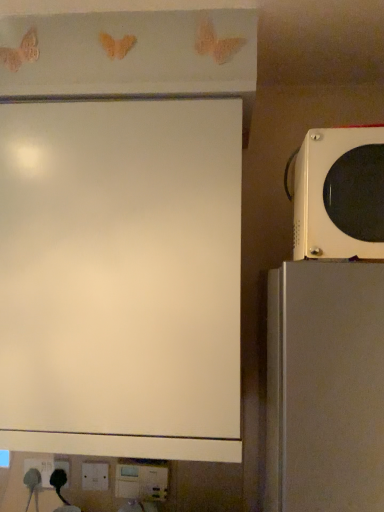
Question: Does white plastic electric outlet at lower left have a greater width compared to white glossy microwave at right?

Choices:
 (A) no
 (B) yes

Answer: (A)

Question: Is white plastic electric outlet at lower left next to white glossy microwave at right?

Choices:
 (A) yes
 (B) no

Answer: (B)

Question: Is white plastic electric outlet at lower left far from white glossy microwave at right?

Choices:
 (A) yes
 (B) no

Answer: (A)

Question: From the image's perspective, would you say white plastic electric outlet at lower left is shown under white glossy microwave at right?

Choices:
 (A) yes
 (B) no

Answer: (A)

Question: Does white plastic electric outlet at lower left have a smaller size compared to white glossy microwave at right?

Choices:
 (A) yes
 (B) no

Answer: (A)

Question: Can you confirm if white plastic electric outlet at lower left is positioned to the left of white glossy microwave at right?

Choices:
 (A) no
 (B) yes

Answer: (B)

Question: Is white glossy microwave at right outside of white matte board at upper left?

Choices:
 (A) no
 (B) yes

Answer: (B)

Question: From a real-world perspective, is white glossy microwave at right over white matte board at upper left?

Choices:
 (A) no
 (B) yes

Answer: (B)

Question: Considering the relative positions of white glossy microwave at right and white matte board at upper left in the image provided, is white glossy microwave at right to the right of white matte board at upper left from the viewer's perspective?

Choices:
 (A) yes
 (B) no

Answer: (A)

Question: Considering the relative sizes of white glossy microwave at right and white matte board at upper left in the image provided, is white glossy microwave at right smaller than white matte board at upper left?

Choices:
 (A) no
 (B) yes

Answer: (B)

Question: From a real-world perspective, is white glossy microwave at right beneath white matte board at upper left?

Choices:
 (A) yes
 (B) no

Answer: (B)

Question: Considering the relative sizes of white glossy microwave at right and white matte board at upper left in the image provided, is white glossy microwave at right taller than white matte board at upper left?

Choices:
 (A) no
 (B) yes

Answer: (A)

Question: Is white plastic electric outlet at lower left not within white matte board at upper left?

Choices:
 (A) yes
 (B) no

Answer: (A)